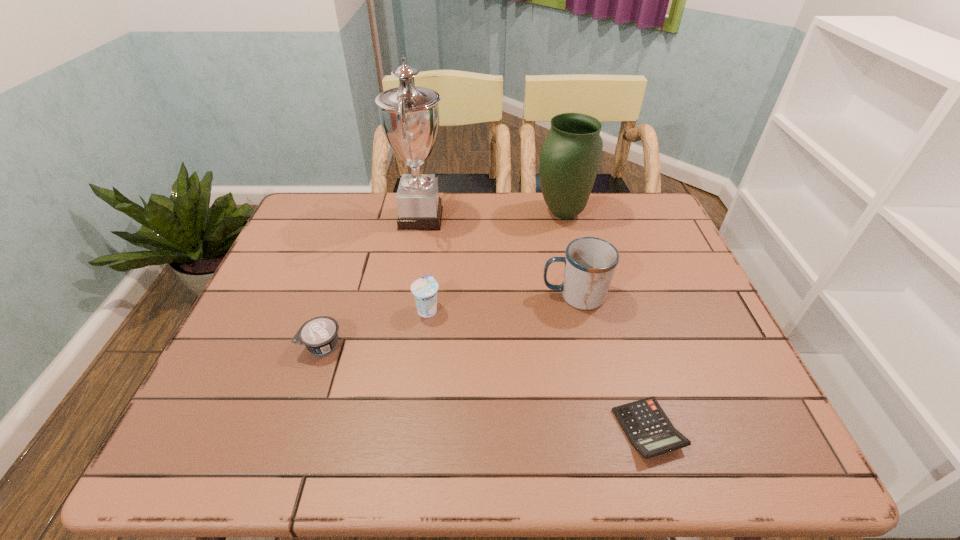
Locate an element on the screen. The height and width of the screenshot is (540, 960). blank space located on the right of the second tallest object is located at coordinates (611, 213).

Where is `free space located 0.380m on the handle side of the mug`? This screenshot has height=540, width=960. free space located 0.380m on the handle side of the mug is located at coordinates (393, 296).

I want to click on vacant area located on the handle side of the mug, so click(447, 296).

Locate an element on the screen. free space located 0.240m on the handle side of the mug is located at coordinates (447, 296).

The height and width of the screenshot is (540, 960). In order to click on vacant area located on the right of the taller yogurt in this screenshot , I will do `click(586, 309)`.

The height and width of the screenshot is (540, 960). I want to click on free region located 0.140m on the back of the leftmost object, so click(x=341, y=289).

Find the location of a particular element. free spot located 0.240m on the back of the shortest object is located at coordinates (613, 313).

Image resolution: width=960 pixels, height=540 pixels. I want to click on trophy cup present at the far edge, so click(409, 115).

Locate an element on the screen. vase at the far edge is located at coordinates (570, 157).

This screenshot has height=540, width=960. I want to click on object that is at the near edge, so click(x=647, y=427).